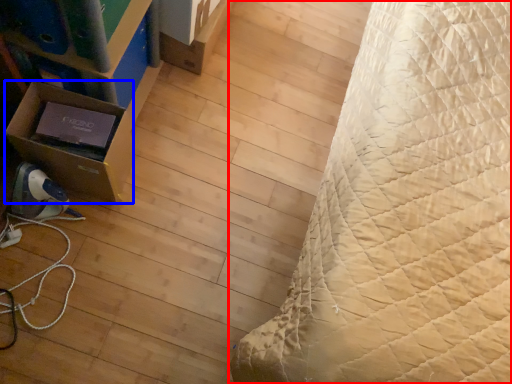
Question: Which of the following is the closest to the observer, bed (highlighted by a red box) or cardboard box (highlighted by a blue box)?

Choices:
 (A) bed
 (B) cardboard box

Answer: (A)